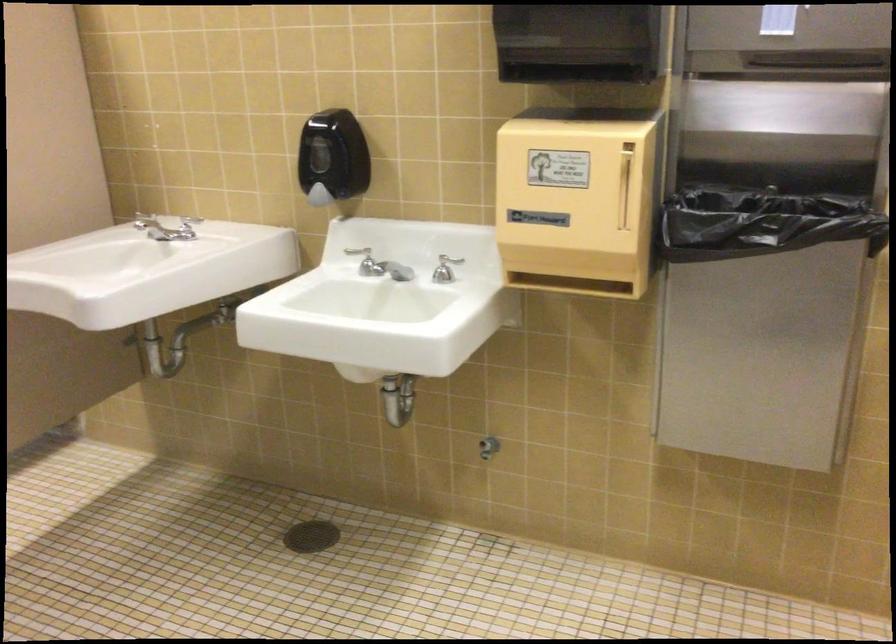
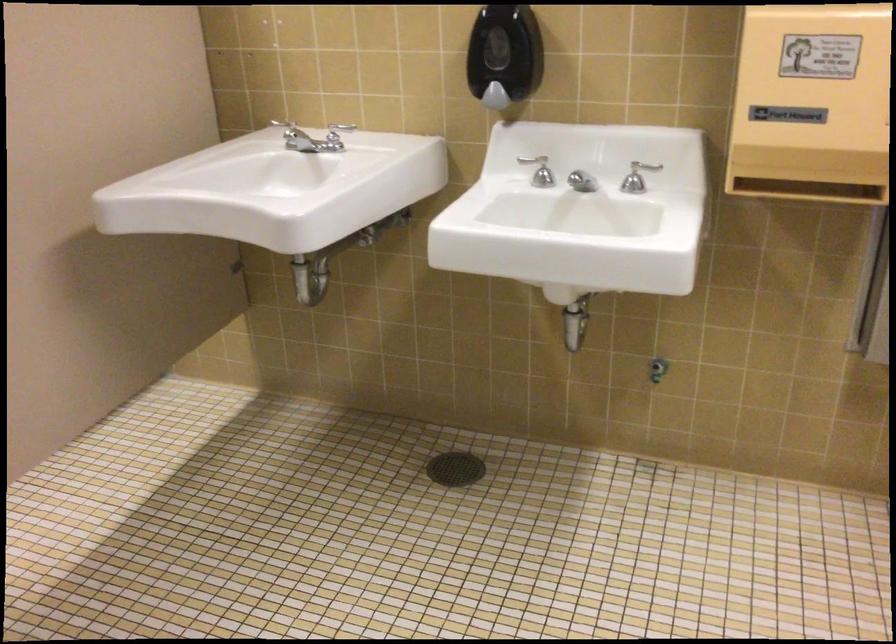
Question: How did the camera likely rotate?

Choices:
 (A) Left
 (B) Right
 (C) Up
 (D) Down

Answer: (D)